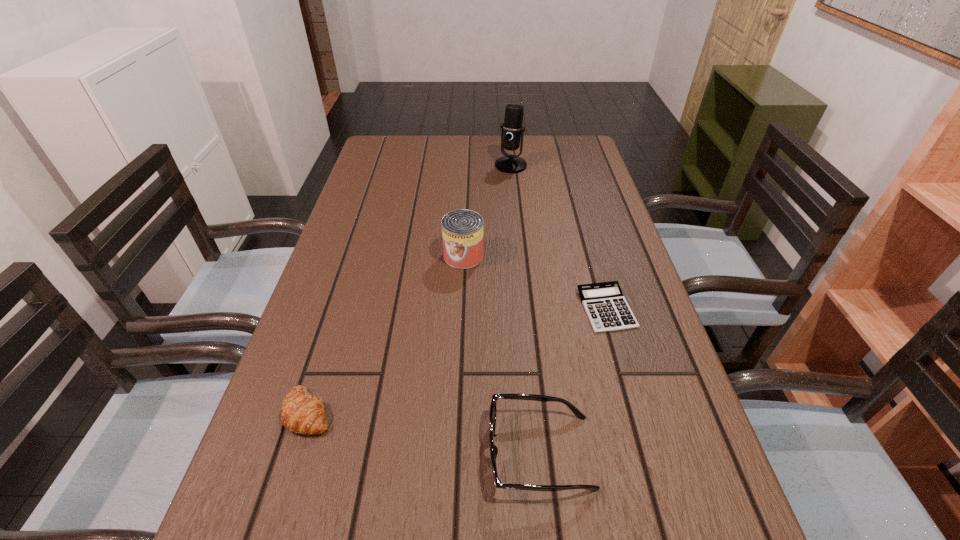
Identify the location of blank area located on the front of the fourth object from right to left. The image size is (960, 540). (459, 363).

Identify the location of vacant area situated on the lenses of the third tallest object. (396, 453).

This screenshot has width=960, height=540. What are the coordinates of `vacant space located 0.370m on the lenses of the third tallest object` in the screenshot? It's located at (261, 453).

This screenshot has height=540, width=960. Identify the location of free space located 0.250m on the lenses of the third tallest object. (335, 453).

I want to click on free space located on the right of the fourth tallest object, so click(397, 412).

Locate an element on the screen. The height and width of the screenshot is (540, 960). free space located on the left of the shortest object is located at coordinates (460, 308).

Image resolution: width=960 pixels, height=540 pixels. Find the location of `object present at the far edge`. object present at the far edge is located at coordinates (512, 131).

Locate an element on the screen. object located in the left edge section of the desktop is located at coordinates (302, 413).

Locate an element on the screen. object that is positioned at the right edge is located at coordinates pyautogui.click(x=607, y=309).

The width and height of the screenshot is (960, 540). What are the coordinates of `vacant space at the far edge` in the screenshot? It's located at (469, 145).